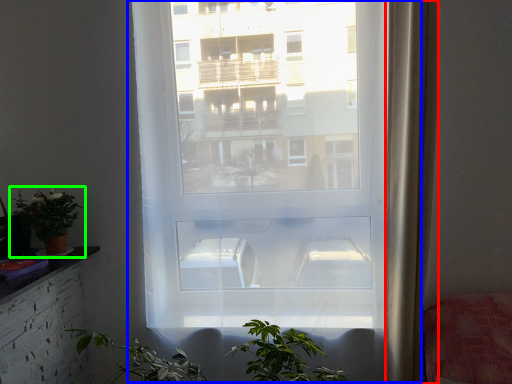
Question: Estimate the real-world distances between objects in this image. Which object is closer to curtain (highlighted by a red box), window (highlighted by a blue box) or houseplant (highlighted by a green box)?

Choices:
 (A) window
 (B) houseplant

Answer: (A)